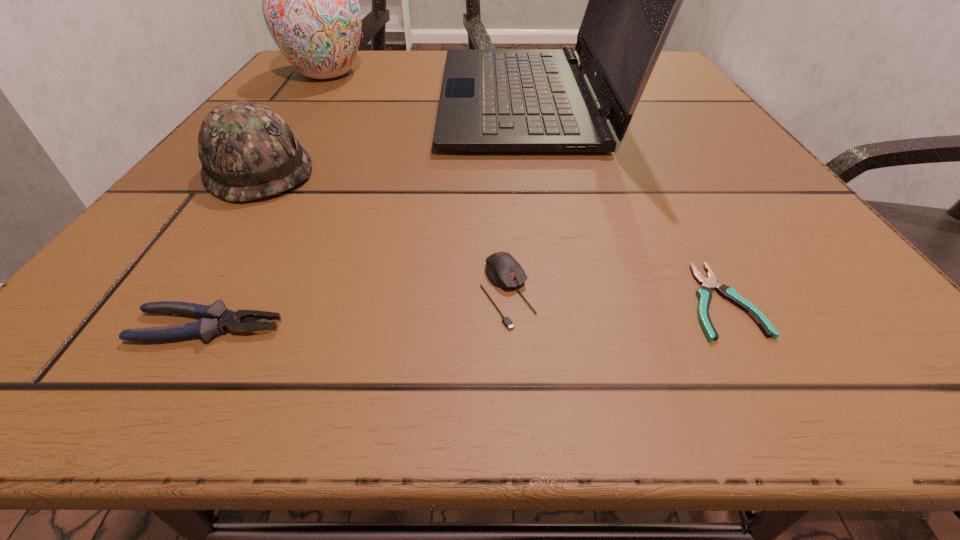
Where is `headwear that is positioned at the left edge`? The width and height of the screenshot is (960, 540). headwear that is positioned at the left edge is located at coordinates (247, 151).

Identify the location of pliers that is positioned at the left edge. (215, 318).

I want to click on laptop computer that is at the right edge, so click(x=492, y=100).

The height and width of the screenshot is (540, 960). What are the coordinates of `pliers positioned at the right edge` in the screenshot? It's located at (704, 293).

Where is `object present at the far left corner`? object present at the far left corner is located at coordinates (310, 4).

Locate an element on the screen. The image size is (960, 540). object that is at the near left corner is located at coordinates (215, 318).

You are a GUI agent. You are given a task and a screenshot of the screen. Output one action in this format:
    pyautogui.click(x=<x>, y=<y>)
    Task: Click on the object present at the far right corner
    The image size is (960, 540).
    Given the screenshot: What is the action you would take?
    pyautogui.click(x=492, y=100)

You are a GUI agent. You are given a task and a screenshot of the screen. Output one action in this format:
    pyautogui.click(x=<x>, y=<y>)
    Task: Click on the object positioned at the near right corner
    This screenshot has width=960, height=540.
    Given the screenshot: What is the action you would take?
    pyautogui.click(x=704, y=293)

Find the location of `vacant space at the far edge of the desktop`. vacant space at the far edge of the desktop is located at coordinates click(x=395, y=80).

In the image, there is a desktop. What are the coordinates of `free space at the right edge` in the screenshot? It's located at (657, 140).